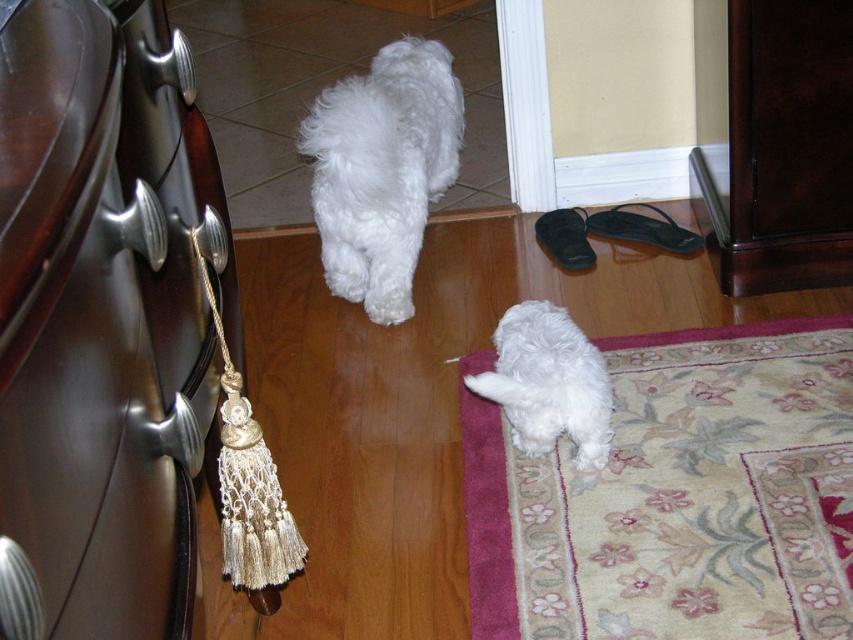
Question: Can you confirm if shiny dark wood drawer at left is bigger than white fluffy dog at center?

Choices:
 (A) no
 (B) yes

Answer: (A)

Question: Is shiny dark wood drawer at left above white fluffy dog at center?

Choices:
 (A) yes
 (B) no

Answer: (B)

Question: Which point appears farthest from the camera in this image?

Choices:
 (A) (820, 172)
 (B) (381, 144)
 (C) (570, 432)

Answer: (A)

Question: Is the position of shiny dark wood drawer at left more distant than that of dark brown wood dresser at lower right?

Choices:
 (A) yes
 (B) no

Answer: (B)

Question: Estimate the real-world distances between objects in this image. Which object is farther from the shiny dark wood drawer at left?

Choices:
 (A) white fluffy dog at lower center
 (B) white fluffy dog at center

Answer: (B)

Question: Which object appears closest to the camera in this image?

Choices:
 (A) white fluffy dog at center
 (B) white fluffy dog at lower center
 (C) shiny dark wood drawer at left

Answer: (C)